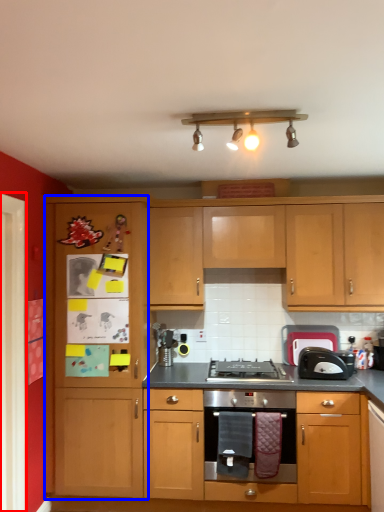
Question: Among these objects, which one is nearest to the camera, glass door (highlighted by a red box) or file cabinet (highlighted by a blue box)?

Choices:
 (A) glass door
 (B) file cabinet

Answer: (A)